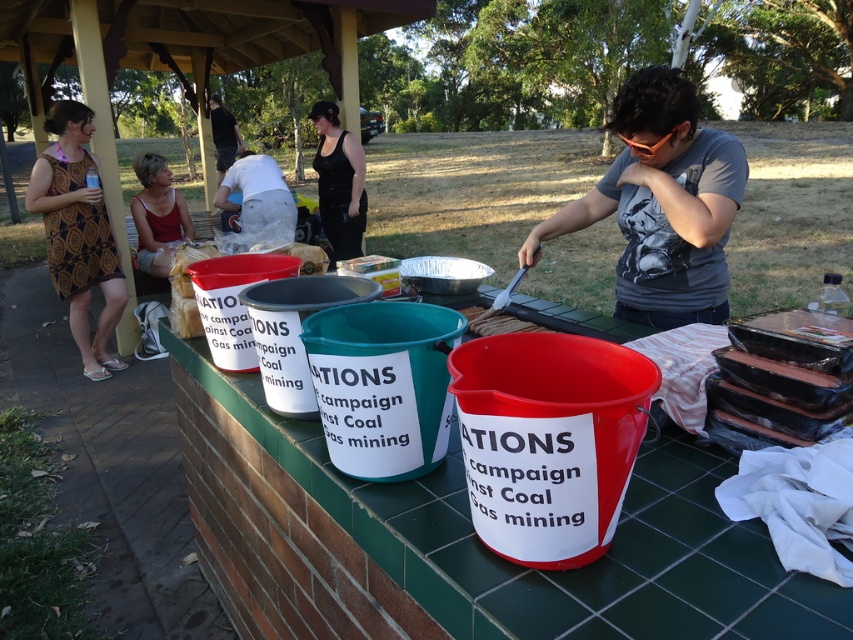
You are a photographer taking a picture of the scene. You want to ensure that both the patterned fabric dress at left and the black fabric at center are visible in the frame. Based on their positions, which object should you focus on first to capture both in the shot?

The patterned fabric dress at left is positioned under the black fabric at center. To capture both in the frame, focus on the black fabric at center first as it is above the dress, ensuring the dress below remains in view.

You are a photographer standing in front of the tiled counter. You notice two people wearing the patterned fabric dress at left and the matte red tank top at left. Which clothing item is positioned more to the left side of the counter?

The patterned fabric dress at left is positioned more to the left side of the counter than the matte red tank top at left.

You are a photographer standing at the edge of the scene. You want to capture a photo that includes both the patterned fabric dress at left and the black fabric at center. What is the minimum distance you need to move backward to ensure both are in frame?

The patterned fabric dress at left is 5.98 feet from the black fabric at center. To capture both in the frame, you need to move back at least 5.98 feet to ensure both are visible.